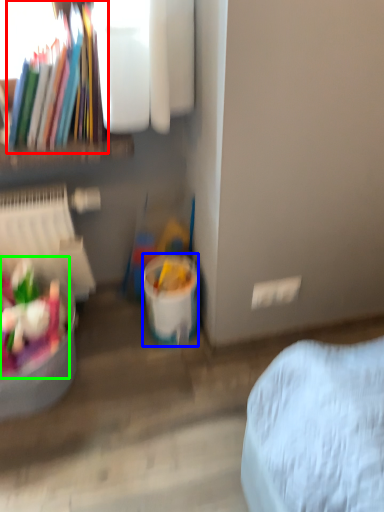
Question: Based on their relative distances, which object is nearer to book (highlighted by a red box)? Choose from bucket (highlighted by a blue box) and food (highlighted by a green box).

Choices:
 (A) bucket
 (B) food

Answer: (B)